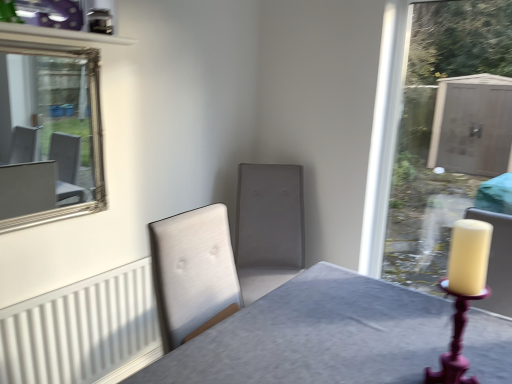
Find the location of `vacant space situated above white ribbed radiator at lower left (from a real-world perspective)`. vacant space situated above white ribbed radiator at lower left (from a real-world perspective) is located at coordinates click(88, 281).